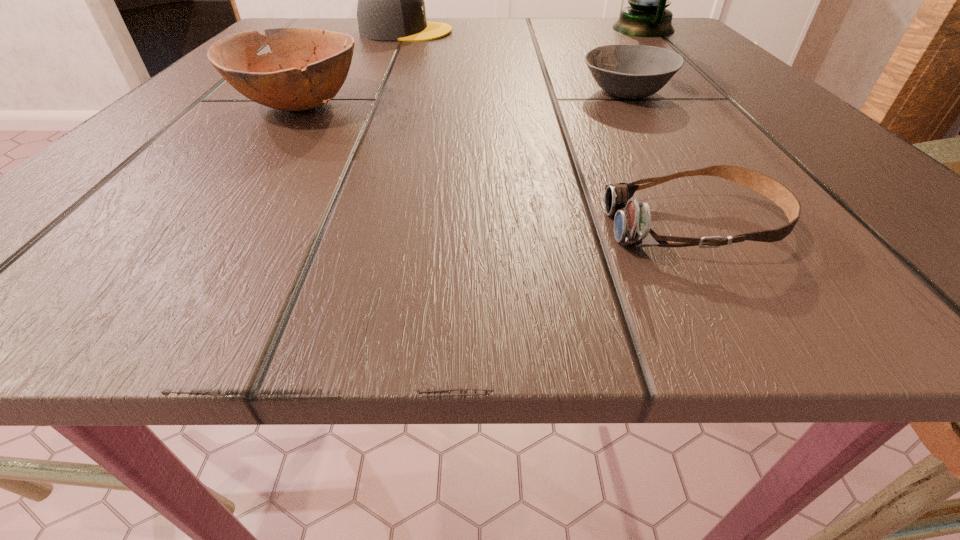
You are a GUI agent. You are given a task and a screenshot of the screen. Output one action in this format:
    pyautogui.click(x=<x>, y=<y>)
    Task: Click on the vacant area at the near left corner of the desktop
    The height and width of the screenshot is (540, 960).
    Given the screenshot: What is the action you would take?
    pyautogui.click(x=139, y=237)

This screenshot has height=540, width=960. Find the location of `vacant region between the right bowl and the taller bowl`. vacant region between the right bowl and the taller bowl is located at coordinates (463, 99).

What are the coordinates of `vacant space that's between the cap and the lantern` in the screenshot? It's located at tap(524, 30).

Where is `free space between the taller bowl and the right bowl`? free space between the taller bowl and the right bowl is located at coordinates (463, 99).

Locate an element on the screen. The height and width of the screenshot is (540, 960). free space between the taller bowl and the right bowl is located at coordinates (463, 99).

Identify the location of vacant region between the shorter bowl and the cap. (516, 62).

You are a GUI agent. You are given a task and a screenshot of the screen. Output one action in this format:
    pyautogui.click(x=<x>, y=<y>)
    Task: Click on the free space between the cap and the shorter bowl
    The width and height of the screenshot is (960, 540).
    Given the screenshot: What is the action you would take?
    pyautogui.click(x=516, y=62)

The width and height of the screenshot is (960, 540). In order to click on vacant area between the lantern and the cap in this screenshot , I will do `click(524, 30)`.

The image size is (960, 540). I want to click on vacant point located between the nearest object and the taller bowl, so click(496, 166).

Where is `vacant area that lies between the goggles and the lantern`? The width and height of the screenshot is (960, 540). vacant area that lies between the goggles and the lantern is located at coordinates (668, 128).